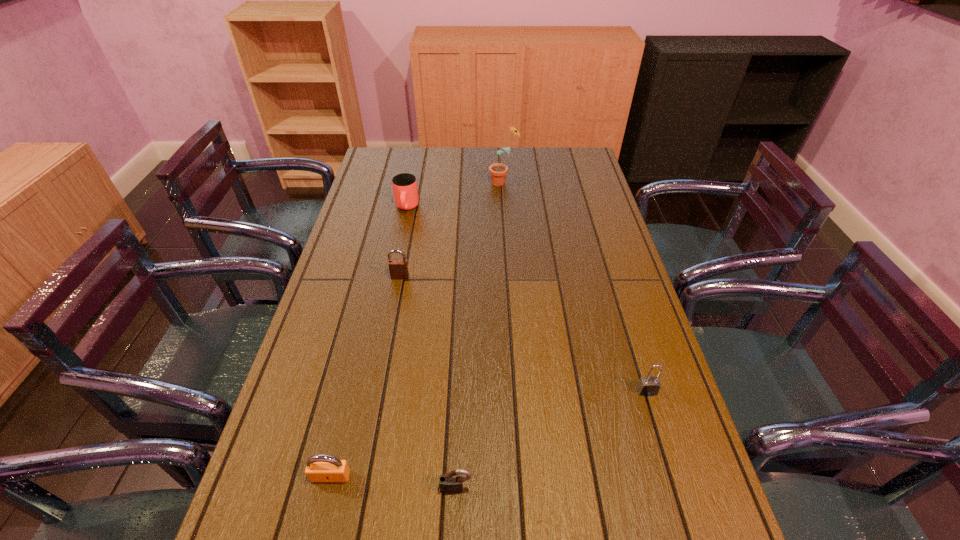
Locate an element on the screen. vacant point located on the flower of the second object from right to left is located at coordinates (390, 182).

You are a GUI agent. You are given a task and a screenshot of the screen. Output one action in this format:
    pyautogui.click(x=<x>, y=<y>)
    Task: Click on the vacant space located 0.220m on the flower of the second object from right to left
    The image size is (960, 540).
    Given the screenshot: What is the action you would take?
    pyautogui.click(x=433, y=182)

Find the location of `free space located 0.090m on the handle side of the cup`. free space located 0.090m on the handle side of the cup is located at coordinates (401, 233).

Where is `free space located on the front-facing side of the third farthest object`? This screenshot has width=960, height=540. free space located on the front-facing side of the third farthest object is located at coordinates (395, 303).

The height and width of the screenshot is (540, 960). Identify the location of free region located on the shackle of the rightmost object. (656, 420).

Image resolution: width=960 pixels, height=540 pixels. I want to click on vacant area situated to unlock the second nearest padlock from the front, so click(x=323, y=509).

This screenshot has height=540, width=960. What are the coordinates of `object that is at the far edge` in the screenshot? It's located at (498, 171).

Find the location of a particular element. Image resolution: width=960 pixels, height=540 pixels. cup present at the left edge is located at coordinates (405, 190).

You are a GUI agent. You are given a task and a screenshot of the screen. Output one action in this format:
    pyautogui.click(x=<x>, y=<y>)
    Task: Click on the padlock located in the left edge section of the desktop
    This screenshot has height=540, width=960.
    Given the screenshot: What is the action you would take?
    pyautogui.click(x=319, y=468)

Locate an element on the screen. object located at the right edge is located at coordinates (648, 386).